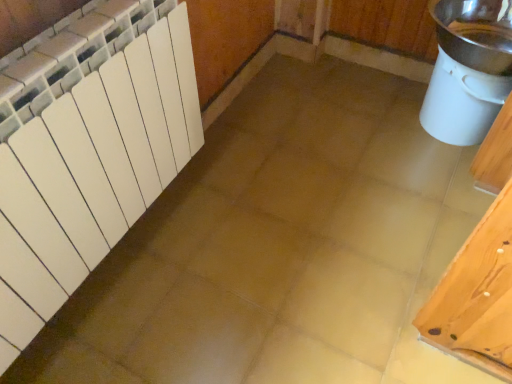
Question: Is white plastic bucket at right facing towards white matte radiator at left?

Choices:
 (A) yes
 (B) no

Answer: (B)

Question: Does white plastic bucket at right appear on the left side of white matte radiator at left?

Choices:
 (A) yes
 (B) no

Answer: (B)

Question: Considering the relative sizes of white plastic bucket at right and white matte radiator at left in the image provided, is white plastic bucket at right thinner than white matte radiator at left?

Choices:
 (A) no
 (B) yes

Answer: (A)

Question: Is white plastic bucket at right facing away from white matte radiator at left?

Choices:
 (A) no
 (B) yes

Answer: (A)

Question: Is white plastic bucket at right further to the viewer compared to white matte radiator at left?

Choices:
 (A) yes
 (B) no

Answer: (A)

Question: From the image's perspective, is white plastic bucket at right below white matte radiator at left?

Choices:
 (A) yes
 (B) no

Answer: (B)

Question: Can you confirm if white matte radiator at left is smaller than white plastic bucket at right?

Choices:
 (A) yes
 (B) no

Answer: (B)

Question: From a real-world perspective, does white matte radiator at left stand above white plastic bucket at right?

Choices:
 (A) yes
 (B) no

Answer: (A)

Question: Can you confirm if white matte radiator at left is taller than white plastic bucket at right?

Choices:
 (A) yes
 (B) no

Answer: (A)

Question: Is white plastic bucket at right surrounded by white matte radiator at left?

Choices:
 (A) no
 (B) yes

Answer: (A)

Question: From a real-world perspective, is white matte radiator at left located beneath white plastic bucket at right?

Choices:
 (A) yes
 (B) no

Answer: (B)

Question: Considering the relative positions of white matte radiator at left and white plastic bucket at right in the image provided, is white matte radiator at left behind white plastic bucket at right?

Choices:
 (A) yes
 (B) no

Answer: (B)

Question: Is white matte radiator at left spatially inside white plastic bucket at right, or outside of it?

Choices:
 (A) outside
 (B) inside

Answer: (A)